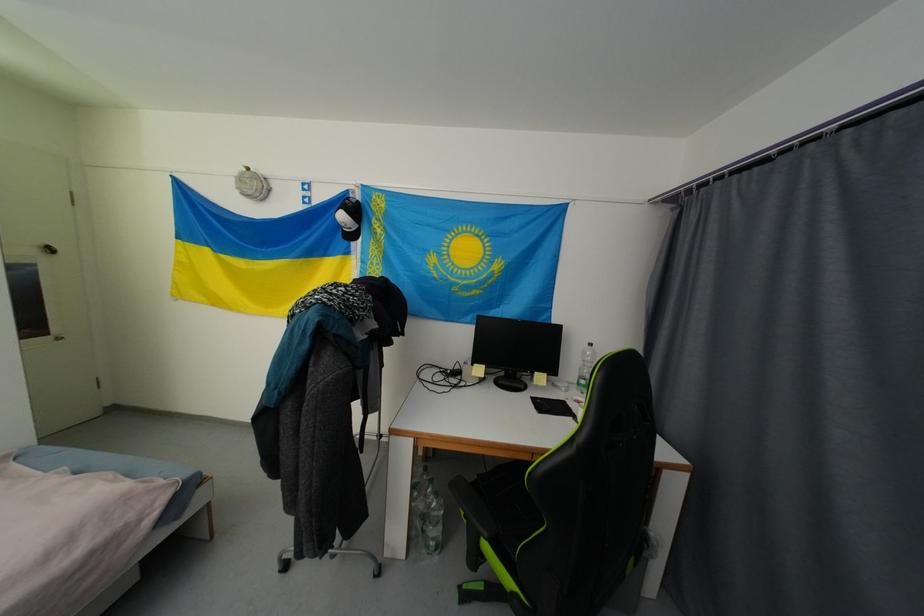
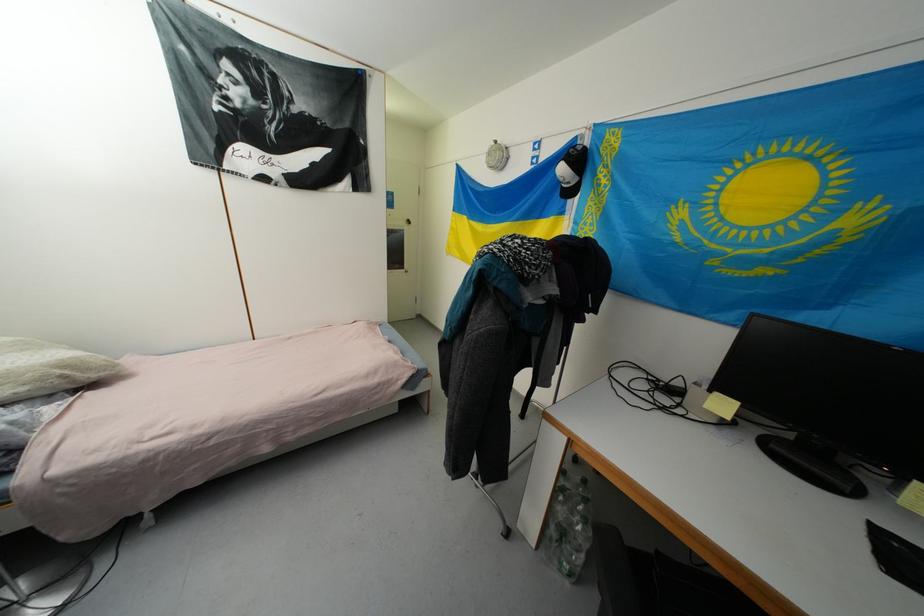
Question: The first image is from the beginning of the video and the second image is from the end. How did the camera likely rotate when shooting the video?

Choices:
 (A) Left
 (B) Right
 (C) Up
 (D) Down

Answer: (A)